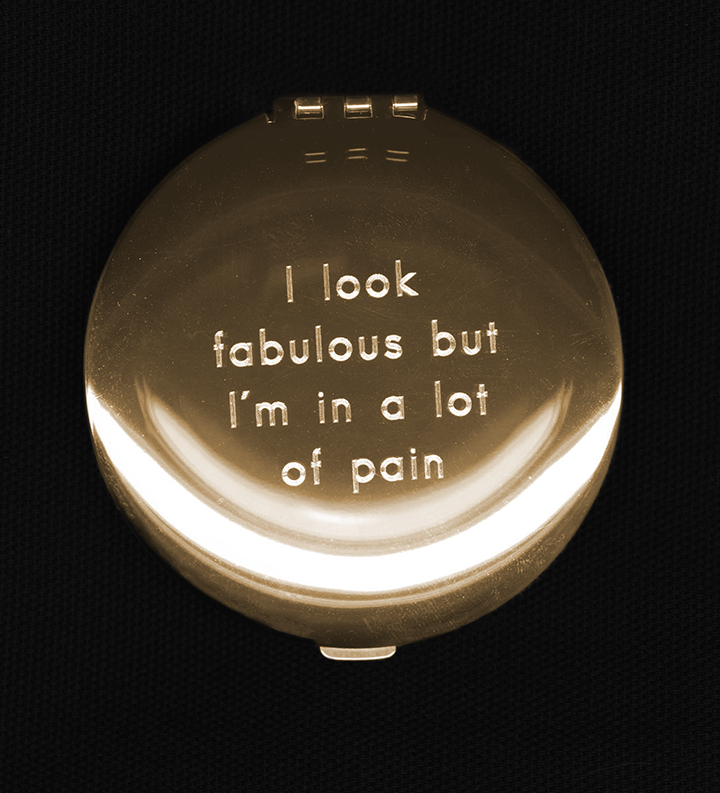
The height and width of the screenshot is (793, 720). Find the location of `hinges`. hinges is located at coordinates (307, 101), (356, 105), (409, 102).